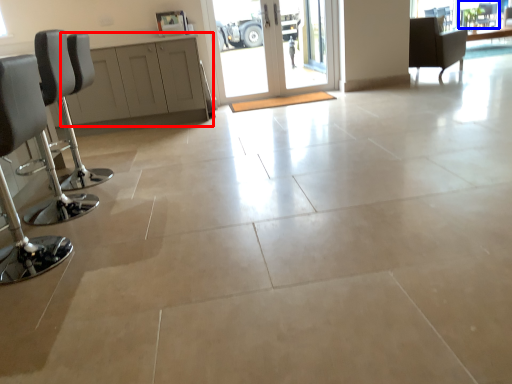
Question: Among these objects, which one is nearest to the camera, cabinetry (highlighted by a red box) or window screen (highlighted by a blue box)?

Choices:
 (A) cabinetry
 (B) window screen

Answer: (A)